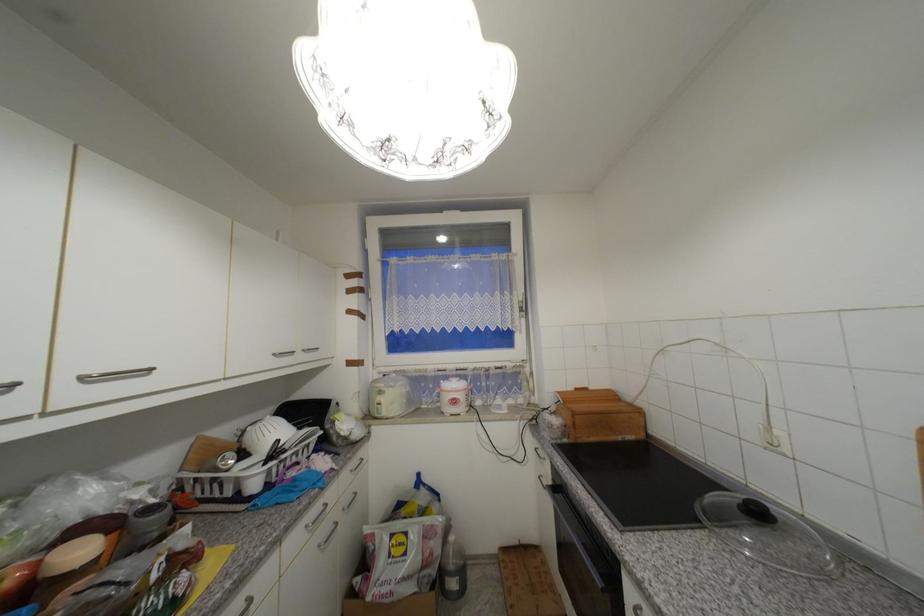
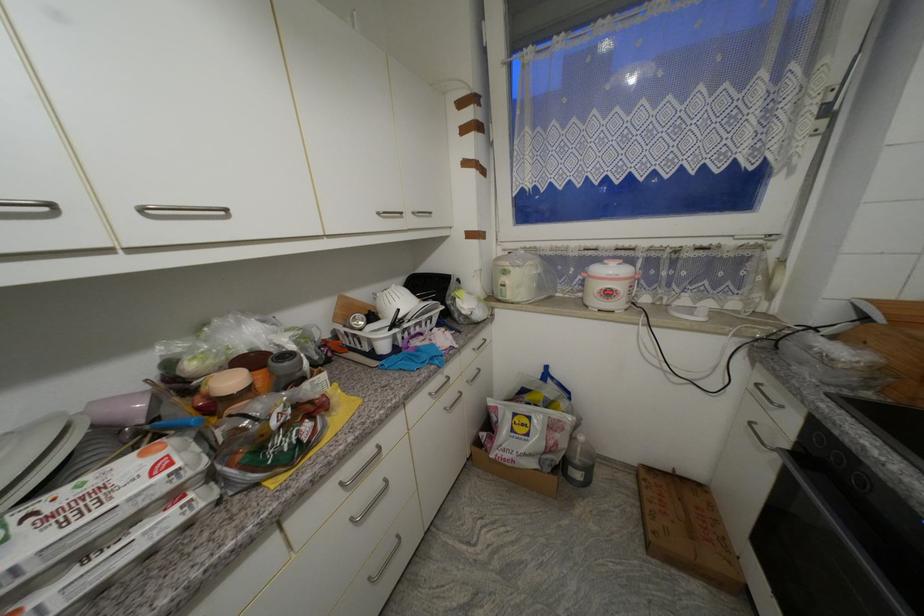
How did the camera likely rotate?

The camera rotated toward left-down.